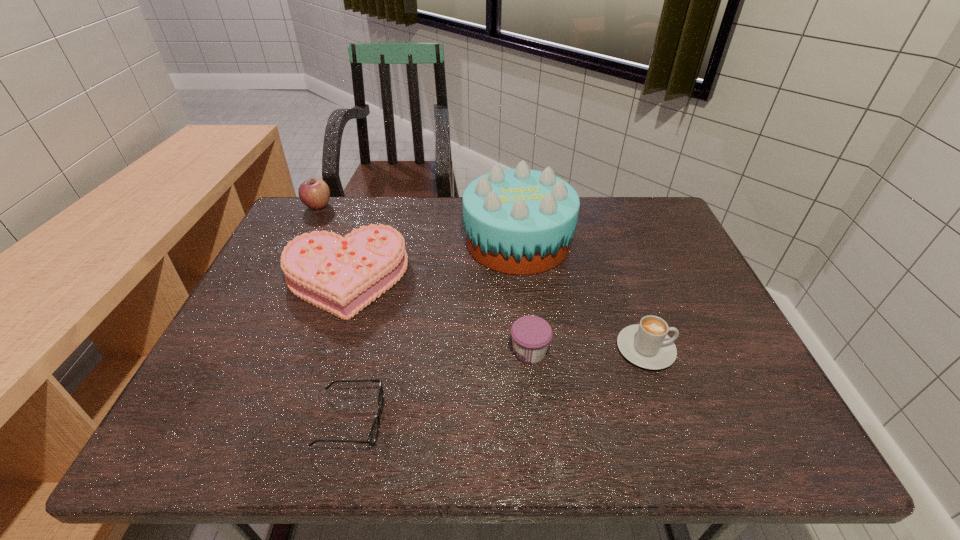
This screenshot has width=960, height=540. What are the coordinates of `the right cake` in the screenshot? It's located at (519, 221).

Where is `the taller cake`? This screenshot has width=960, height=540. the taller cake is located at coordinates 519,221.

Locate an element on the screen. The height and width of the screenshot is (540, 960). apple is located at coordinates (314, 193).

Where is `the left cake`? This screenshot has height=540, width=960. the left cake is located at coordinates (342, 275).

This screenshot has height=540, width=960. I want to click on cappuccino, so [647, 345].

The image size is (960, 540). Identify the location of jam. (531, 335).

The image size is (960, 540). What are the coordinates of `spectacles` in the screenshot? It's located at coord(374,432).

You are a GUI agent. You are given a task and a screenshot of the screen. Output one action in this format:
    pyautogui.click(x=<x>, y=<y>)
    Task: Click on the shortest object
    Image resolution: width=960 pixels, height=540 pixels.
    Given the screenshot: What is the action you would take?
    pyautogui.click(x=374, y=432)

Where is `vacant region located on the right of the right cake`? The image size is (960, 540). vacant region located on the right of the right cake is located at coordinates (596, 241).

Identify the location of free region located on the right of the second tallest object. The image size is (960, 540). (348, 206).